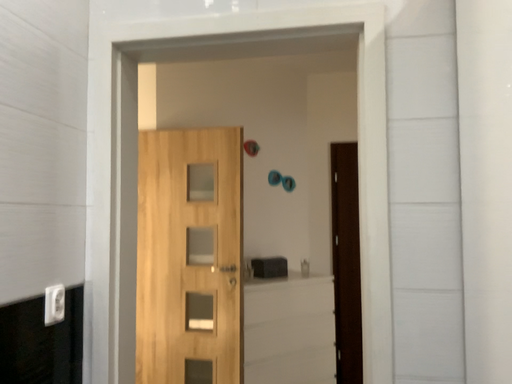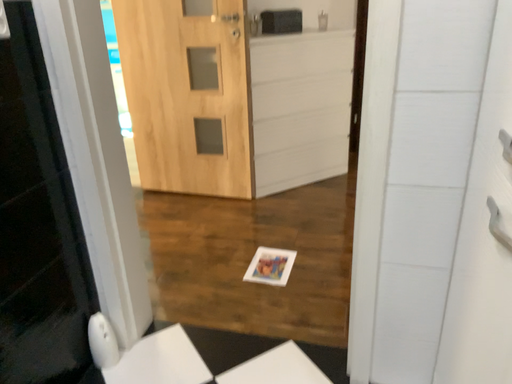
Question: Which way did the camera rotate in the video?

Choices:
 (A) rotated upward
 (B) rotated downward

Answer: (B)